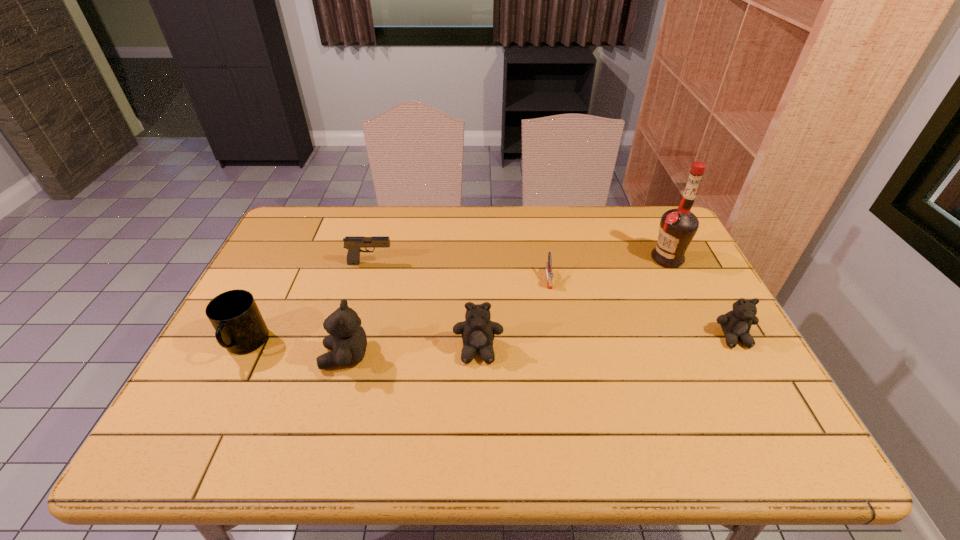
Select which object appears as the sixth closest to the leftmost object. Please provide its 2D coordinates. Your answer should be formatted as a tuple, i.e. [(x, y)], where the tuple contains the x and y coordinates of a point satisfying the conditions above.

[(736, 324)]

Identify which teddy bear is the second nearest to the leftmost teddy bear. Please provide its 2D coordinates. Your answer should be formatted as a tuple, i.e. [(x, y)], where the tuple contains the x and y coordinates of a point satisfying the conditions above.

[(736, 324)]

Locate which teddy bear ranks in proximity to the second shortest teddy bear. Please provide its 2D coordinates. Your answer should be formatted as a tuple, i.e. [(x, y)], where the tuple contains the x and y coordinates of a point satisfying the conditions above.

[(347, 341)]

This screenshot has width=960, height=540. What are the coordinates of `vacant area in the image that satisfies the following two spatial constraints: 1. on the front and back of the tallest object; 2. on the face of the second shortest teddy bear` in the screenshot? It's located at (712, 350).

Where is `free space in the image that satisfies the following two spatial constraints: 1. on the front and back of the liquor; 2. on the side of the mug with the handle`? This screenshot has width=960, height=540. free space in the image that satisfies the following two spatial constraints: 1. on the front and back of the liquor; 2. on the side of the mug with the handle is located at coordinates (709, 345).

I want to click on vacant region that satisfies the following two spatial constraints: 1. on the front and back of the liquor; 2. on the side of the mug with the handle, so click(x=709, y=345).

Identify the location of vacant region that satisfies the following two spatial constraints: 1. on the front and back of the liquor; 2. on the side of the leftmost object with the handle. (709, 345).

You are a GUI agent. You are given a task and a screenshot of the screen. Output one action in this format:
    pyautogui.click(x=<x>, y=<y>)
    Task: Click on the vacant space that satisfies the following two spatial constraints: 1. on the front and back of the tallest object; 2. on the side of the leftmost object with the handle
    The image size is (960, 540).
    Given the screenshot: What is the action you would take?
    pyautogui.click(x=709, y=345)

Where is `vacant area in the image that satisfies the following two spatial constraints: 1. on the front and back of the liquor; 2. on the handle side of the stapler`? vacant area in the image that satisfies the following two spatial constraints: 1. on the front and back of the liquor; 2. on the handle side of the stapler is located at coordinates (677, 279).

Locate an element on the screen. This screenshot has height=540, width=960. vacant position in the image that satisfies the following two spatial constraints: 1. aim along the barrel of the sixth tallest object; 2. on the side of the leftmost object with the handle is located at coordinates (348, 345).